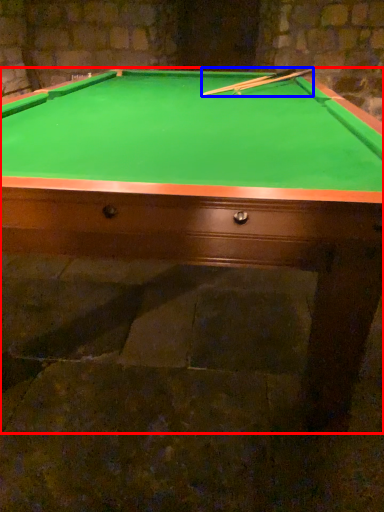
Question: Which object is closer to the camera taking this photo, billiard table (highlighted by a red box) or cue (highlighted by a blue box)?

Choices:
 (A) billiard table
 (B) cue

Answer: (A)